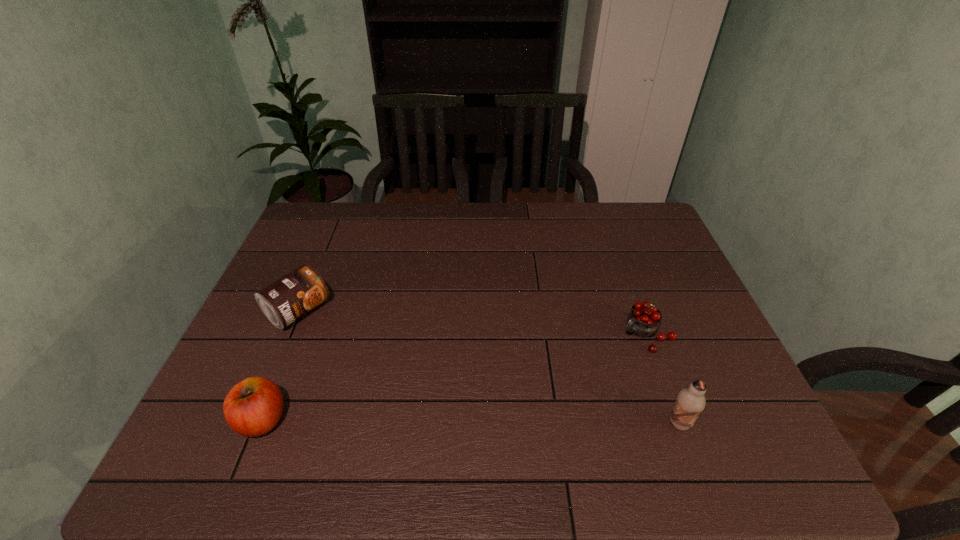
This screenshot has width=960, height=540. Find the location of `free point at the far edge`. free point at the far edge is located at coordinates (451, 243).

This screenshot has height=540, width=960. Identify the location of vacant space at the near edge. (620, 402).

The width and height of the screenshot is (960, 540). Find the location of `vacant space at the left edge`. vacant space at the left edge is located at coordinates (272, 346).

In the image, there is a desktop. Where is `vacant space at the right edge`? The image size is (960, 540). vacant space at the right edge is located at coordinates (655, 291).

At what (x,y) coordinates should I click in order to perform the action: click on vacant area at the far right corner. Please return your answer as a coordinate pair (x, y). The width and height of the screenshot is (960, 540). Looking at the image, I should click on (636, 224).

Where is `free point between the pot filled with cherries and the apple`? The height and width of the screenshot is (540, 960). free point between the pot filled with cherries and the apple is located at coordinates (454, 377).

This screenshot has height=540, width=960. In order to click on unoccupied position between the pot filled with cherries and the apple in this screenshot , I will do coord(454,377).

Locate an element on the screen. This screenshot has width=960, height=540. unoccupied position between the tallest object and the pot filled with cherries is located at coordinates [662, 379].

At what (x,y) coordinates should I click in order to perform the action: click on vacant area between the can and the chocolate milk. Please return your answer as a coordinate pair (x, y). The width and height of the screenshot is (960, 540). Looking at the image, I should click on (489, 367).

This screenshot has width=960, height=540. I want to click on vacant space that is in between the chocolate milk and the can, so click(x=489, y=367).